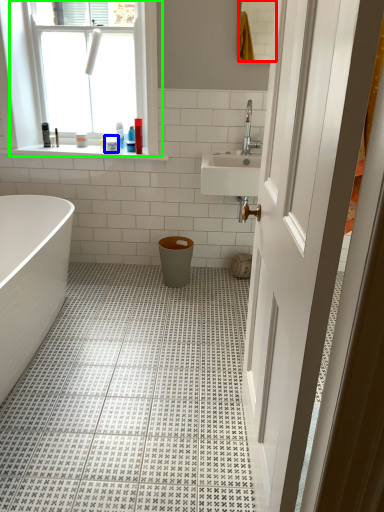
Question: Based on their relative distances, which object is farther from mirror (highlighted by a red box)? Choose from toiletry (highlighted by a blue box) and window (highlighted by a green box).

Choices:
 (A) toiletry
 (B) window

Answer: (A)